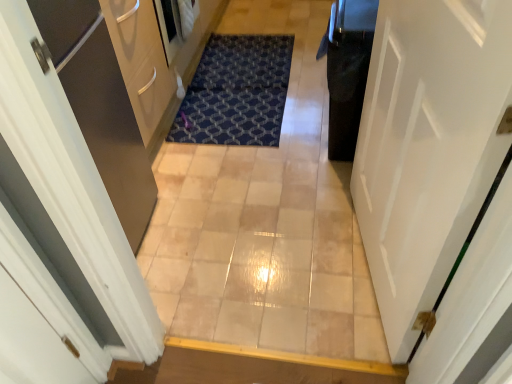
Question: From the image's perspective, is white glossy door at right on top of beige tile corridor at center?

Choices:
 (A) yes
 (B) no

Answer: (B)

Question: Does white glossy door at right appear on the left side of beige tile corridor at center?

Choices:
 (A) yes
 (B) no

Answer: (B)

Question: Can you confirm if white glossy door at right is shorter than beige tile corridor at center?

Choices:
 (A) no
 (B) yes

Answer: (A)

Question: From a real-world perspective, does white glossy door at right stand above beige tile corridor at center?

Choices:
 (A) yes
 (B) no

Answer: (A)

Question: Is white glossy door at right wider than beige tile corridor at center?

Choices:
 (A) no
 (B) yes

Answer: (A)

Question: Based on their positions, is black glossy trash can at right located to the left or right of blue textured mat at center?

Choices:
 (A) left
 (B) right

Answer: (B)

Question: From the image's perspective, is black glossy trash can at right located above or below blue textured mat at center?

Choices:
 (A) below
 (B) above

Answer: (A)

Question: In terms of height, does black glossy trash can at right look taller or shorter compared to blue textured mat at center?

Choices:
 (A) short
 (B) tall

Answer: (B)

Question: Considering the positions of point (373, 13) and point (232, 44), is point (373, 13) closer or farther from the camera than point (232, 44)?

Choices:
 (A) closer
 (B) farther

Answer: (A)

Question: Is blue textured mat at center wider or thinner than black glossy trash can at right?

Choices:
 (A) wide
 (B) thin

Answer: (A)

Question: Is blue textured mat at center in front of or behind black glossy trash can at right in the image?

Choices:
 (A) front
 (B) behind

Answer: (B)

Question: Considering the positions of point (234, 112) and point (355, 56), is point (234, 112) closer or farther from the camera than point (355, 56)?

Choices:
 (A) closer
 (B) farther

Answer: (B)

Question: Is blue textured mat at center taller or shorter than black glossy trash can at right?

Choices:
 (A) short
 (B) tall

Answer: (A)

Question: In the image, is black glossy trash can at right positioned in front of or behind white glossy door at right?

Choices:
 (A) front
 (B) behind

Answer: (B)

Question: From a real-world perspective, is black glossy trash can at right above or below white glossy door at right?

Choices:
 (A) below
 (B) above

Answer: (A)